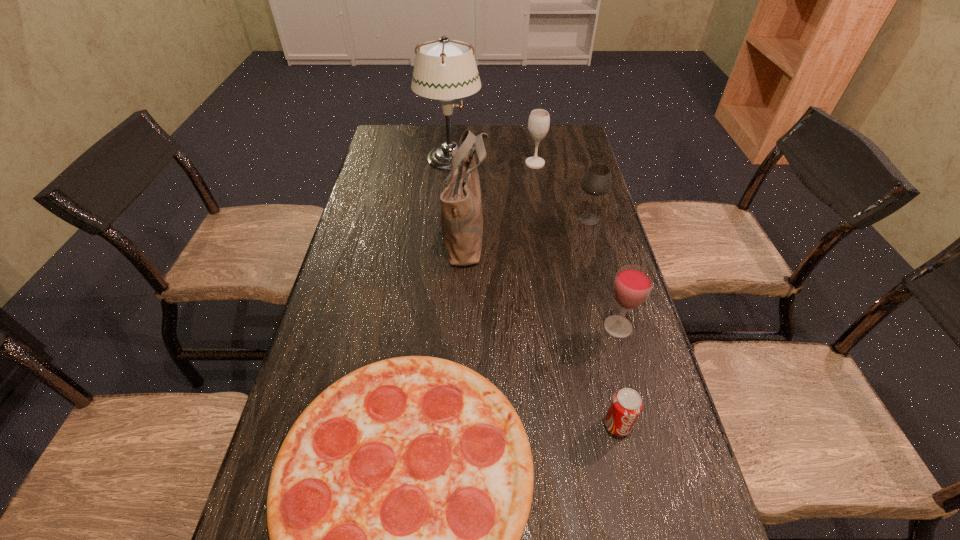
You are a GUI agent. You are given a task and a screenshot of the screen. Output one action in this format:
    pyautogui.click(x=<x>, y=<y>)
    Task: Click on the wineglass that is the second closest to the second farthest wineglass
    Image resolution: width=960 pixels, height=540 pixels.
    Given the screenshot: What is the action you would take?
    pyautogui.click(x=633, y=284)

Locate an element on the screen. blank area in the image that satisfies the following two spatial constraints: 1. on the front side of the leftmost wineglass; 2. on the front-facing side of the shoulder bag is located at coordinates (546, 234).

This screenshot has height=540, width=960. In order to click on vacant position in the image that satisfies the following two spatial constraints: 1. on the lampshade of the lampshade; 2. on the back side of the third nearest object in this screenshot , I will do `click(436, 327)`.

Find the location of a particular element. This screenshot has height=540, width=960. free space that satisfies the following two spatial constraints: 1. on the lampshade of the lampshade; 2. on the left side of the fifth farthest object is located at coordinates (436, 327).

I want to click on free spot that satisfies the following two spatial constraints: 1. on the front-facing side of the sixth shortest object; 2. on the back side of the nearest wineglass, so click(x=463, y=327).

Where is `blank space that satisfies the following two spatial constraints: 1. on the lampshade of the lampshade; 2. on the left side of the farthest wineglass`? blank space that satisfies the following two spatial constraints: 1. on the lampshade of the lampshade; 2. on the left side of the farthest wineglass is located at coordinates (450, 164).